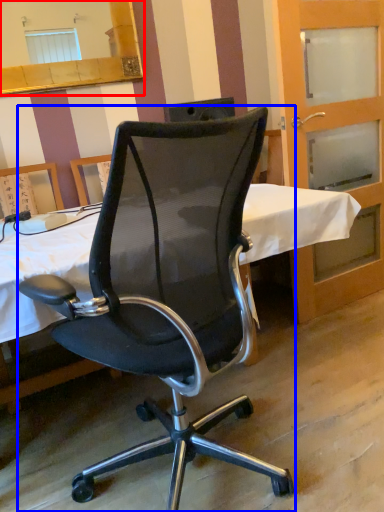
Question: Which object appears farthest to the camera in this image, mirror (highlighted by a red box) or chair (highlighted by a blue box)?

Choices:
 (A) mirror
 (B) chair

Answer: (A)